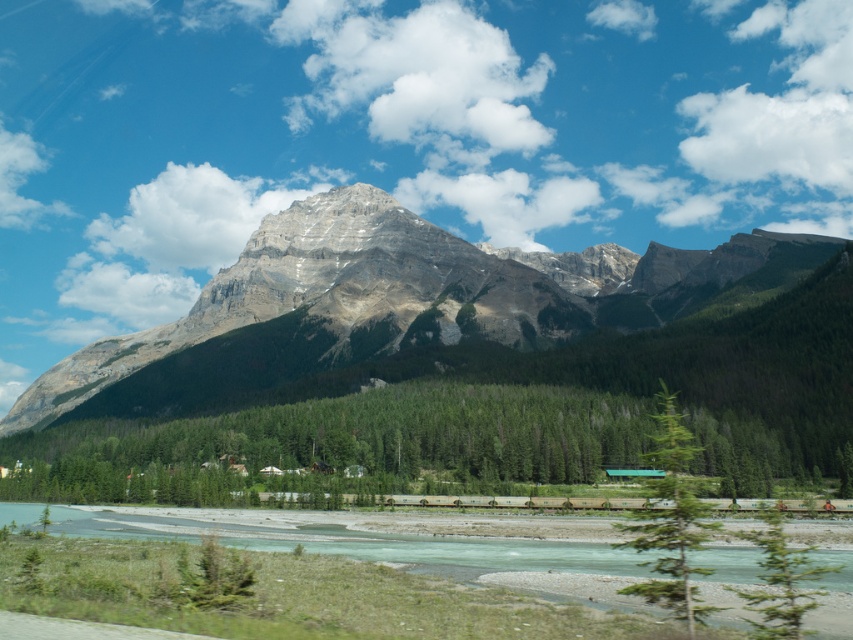
Question: From the image, what is the correct spatial relationship of green matte forest at center in relation to green leafy tree at center?

Choices:
 (A) left
 (B) right

Answer: (A)

Question: Which object is farther from the camera taking this photo?

Choices:
 (A) clear water at center
 (B) rocky gray mountain at center

Answer: (B)

Question: Which point is closer to the camera?

Choices:
 (A) (759, 541)
 (B) (344, 349)

Answer: (A)

Question: Does clear water at center have a greater width compared to green leafy tree at center?

Choices:
 (A) yes
 (B) no

Answer: (A)

Question: Can you confirm if green matte forest at center is wider than green matte tree at lower right?

Choices:
 (A) yes
 (B) no

Answer: (A)

Question: Which point appears farthest from the camera in this image?

Choices:
 (A) (701, 282)
 (B) (778, 540)
 (C) (134, 525)

Answer: (A)